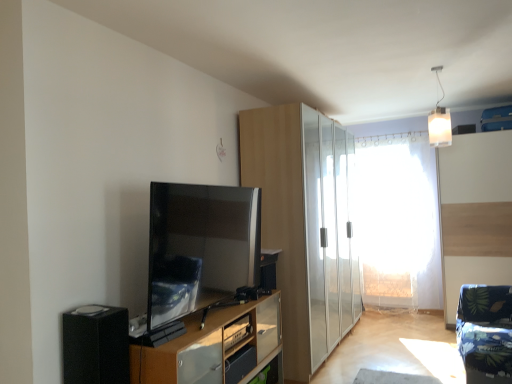
Question: From the image's perspective, is satin black tv at center above or below wooden cabinet at lower center?

Choices:
 (A) above
 (B) below

Answer: (A)

Question: Is satin black tv at center taller or shorter than wooden cabinet at lower center?

Choices:
 (A) tall
 (B) short

Answer: (B)

Question: Based on their relative distances, which object is farther from the white frosted glass pendant light at upper right?

Choices:
 (A) light wood cabinet at center
 (B) black matte speaker at lower left
 (C) satin black tv at center
 (D) wooden cabinet at lower center
 (E) transparent plastic curtain at center

Answer: (B)

Question: Which is nearer to the white frosted glass pendant light at upper right?

Choices:
 (A) satin black tv at center
 (B) black matte speaker at lower left
 (C) transparent plastic curtain at center
 (D) wooden cabinet at lower center
 (E) light wood cabinet at center

Answer: (E)